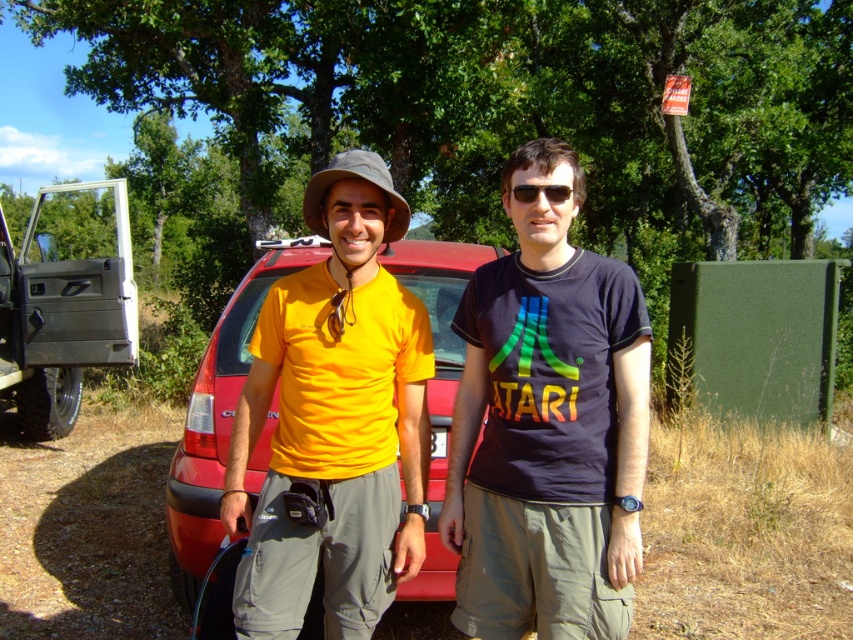
You are planning to take a photo of the metallic gray pickup truck at left and the black plastic sunglasses at center. Which object should you focus on first if you want to capture both in a single frame without moving the camera?

You should focus on the metallic gray pickup truck at left first because it is larger than the black plastic sunglasses at center, ensuring it fits properly in the frame.